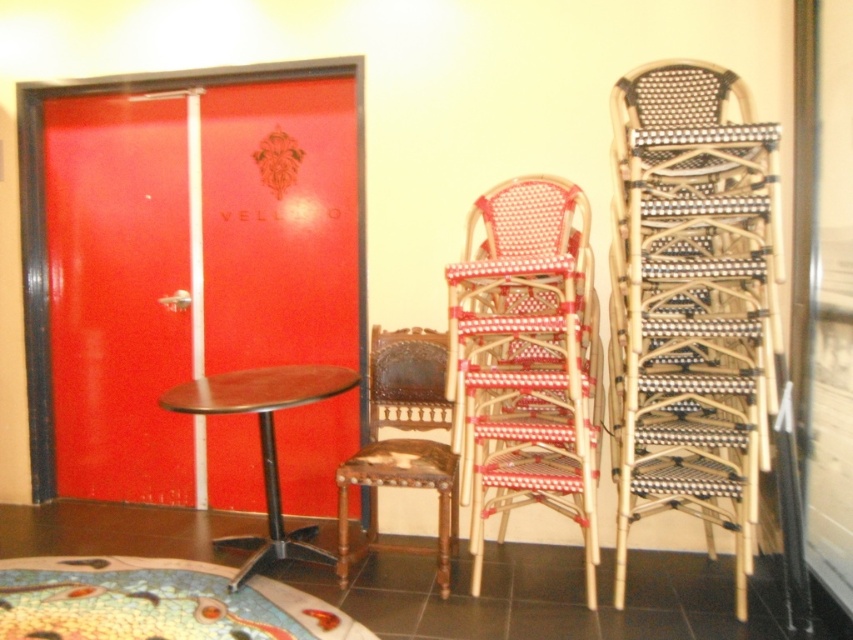
From the picture: You are a customer entering the cafe and want to sit down. There is a woven rattan chair at center and a dark brown wood table at center. Which object is taller?

The woven rattan chair at center is much taller than the dark brown wood table at center.

You are a customer entering the cafe and see the woven rattan chairs at right and the brown wood chair at center. Which chair stack is closer to the entrance?

The woven rattan chairs at right are closer to the entrance because they are in front of the brown wood chair at center, meaning they are positioned nearer to the viewer who is entering through the door.

You are standing in front of the red door with a black frame in the image. To your right, there are two stacks of chairs. The first stack has light brown wooden chairs with red and white woven seats, and the second stack has darker, nearly black woven chairs. Where is the point at coordinate (692, 304) located in this scene?

The point at coordinate (692, 304) is located at the woven rattan chairs at right.